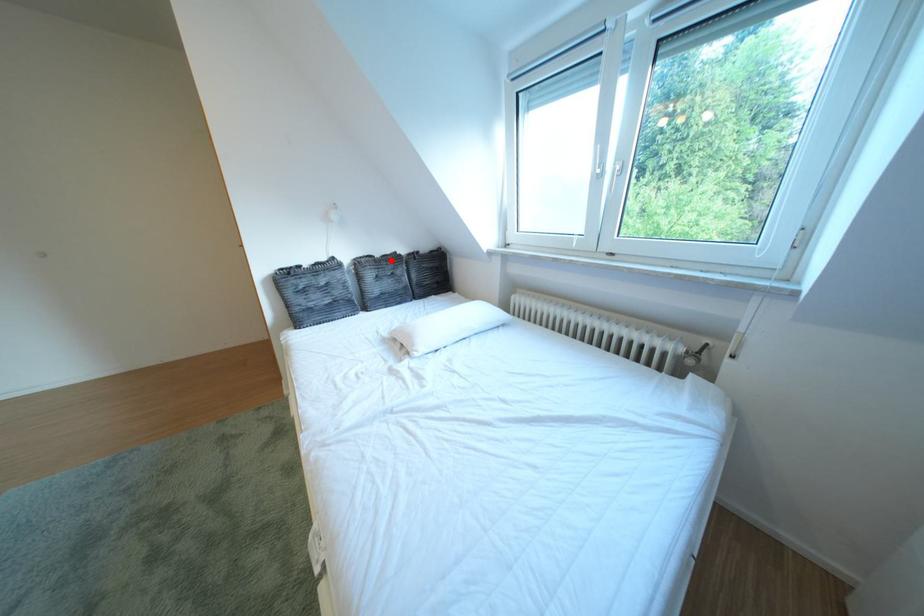
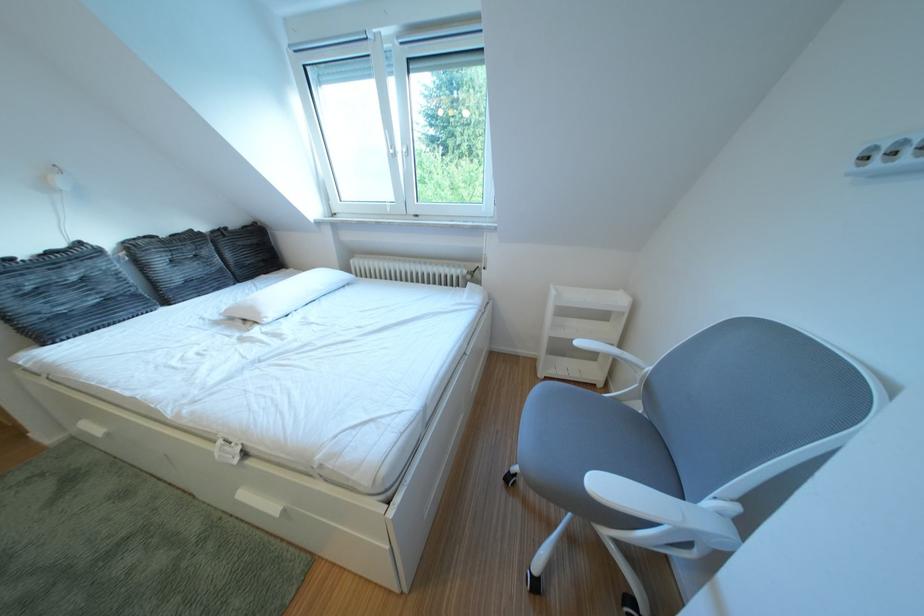
Question: A red point is marked in image1. In image2, is the corresponding 3D point closer to the camera or farther? Reply with the corresponding letter.

Choices:
 (A) The corresponding 3D point is closer.
 (B) The corresponding 3D point is farther.

Answer: (B)